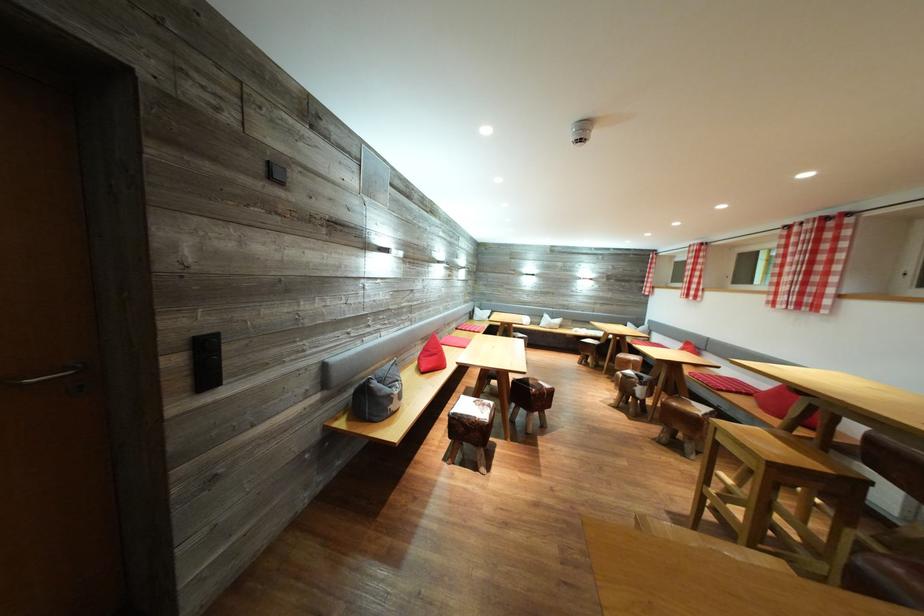
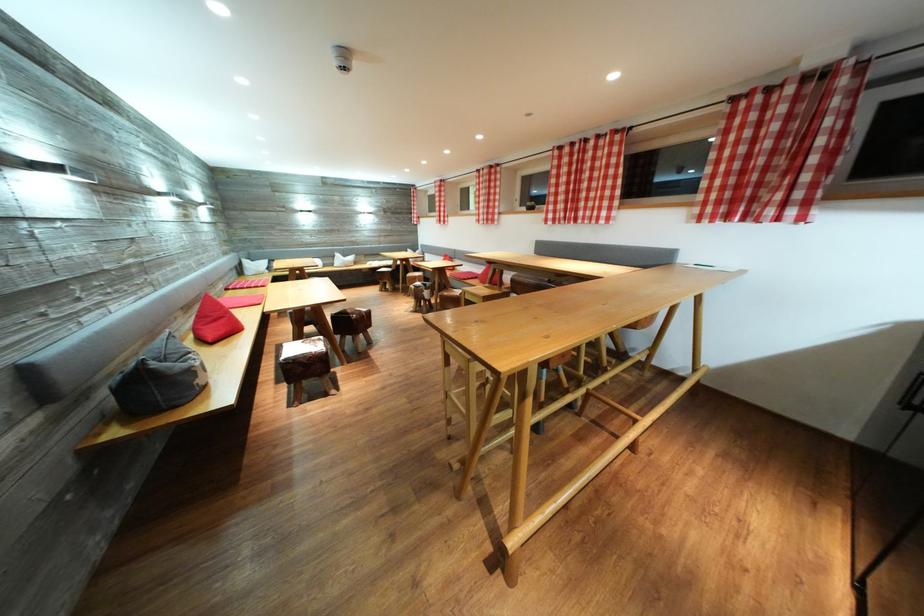
Find the pixel in the second image that matches (490,410) in the first image.

(321, 346)